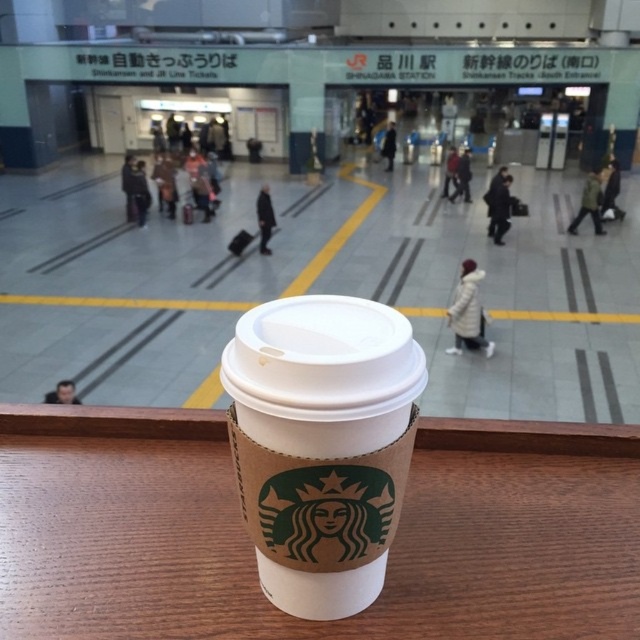
Question: Which of the following is the farthest from the observer?

Choices:
 (A) brown paper cup at center
 (B) wooden table at center

Answer: (B)

Question: In this image, where is wooden table at center located relative to brown paper cup at center?

Choices:
 (A) right
 (B) left

Answer: (B)

Question: Can you confirm if wooden table at center is thinner than brown paper cup at center?

Choices:
 (A) yes
 (B) no

Answer: (B)

Question: Observing the image, what is the correct spatial positioning of wooden table at center in reference to brown paper cup at center?

Choices:
 (A) left
 (B) right

Answer: (A)

Question: Which point is farther to the camera?

Choices:
 (A) brown paper cup at center
 (B) wooden table at center

Answer: (B)